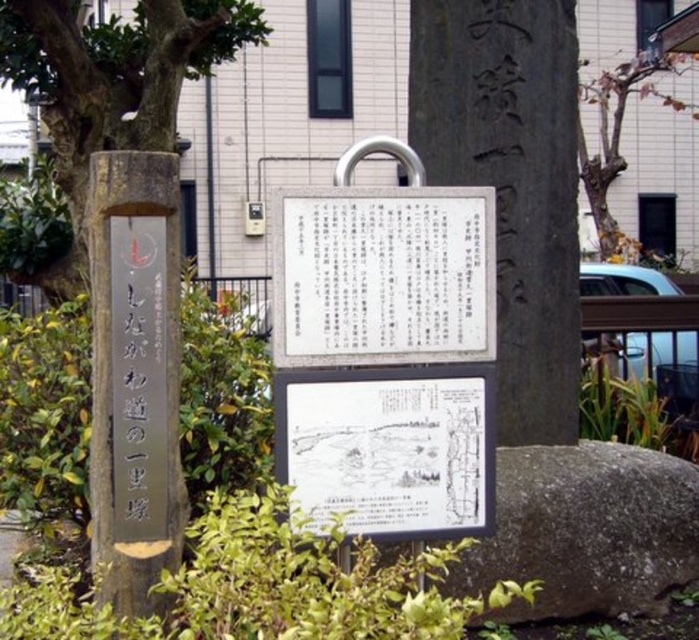
Can you confirm if green leafy tree at left is taller than brown bark tree at upper right?

No.

Does green leafy tree at left have a lesser width compared to brown bark tree at upper right?

No, green leafy tree at left is not thinner than brown bark tree at upper right.

Is point (157, 112) behind point (598, 202)?

No, it is in front of (598, 202).

I want to click on green leafy tree at left, so (110, 84).

Consider the image. Can you confirm if white paper at lower center is taller than green leafy tree at left?

In fact, white paper at lower center may be shorter than green leafy tree at left.

Does white paper at lower center appear on the right side of green leafy tree at left?

Yes, white paper at lower center is to the right of green leafy tree at left.

Describe the element at coordinates (389, 448) in the screenshot. I see `white paper at lower center` at that location.

The image size is (699, 640). Identify the location of white paper at lower center. (389, 448).

Who is positioned more to the left, black stone tree trunk at center or white paper sign at center?

Positioned to the left is white paper sign at center.

The height and width of the screenshot is (640, 699). Identify the location of black stone tree trunk at center. (511, 182).